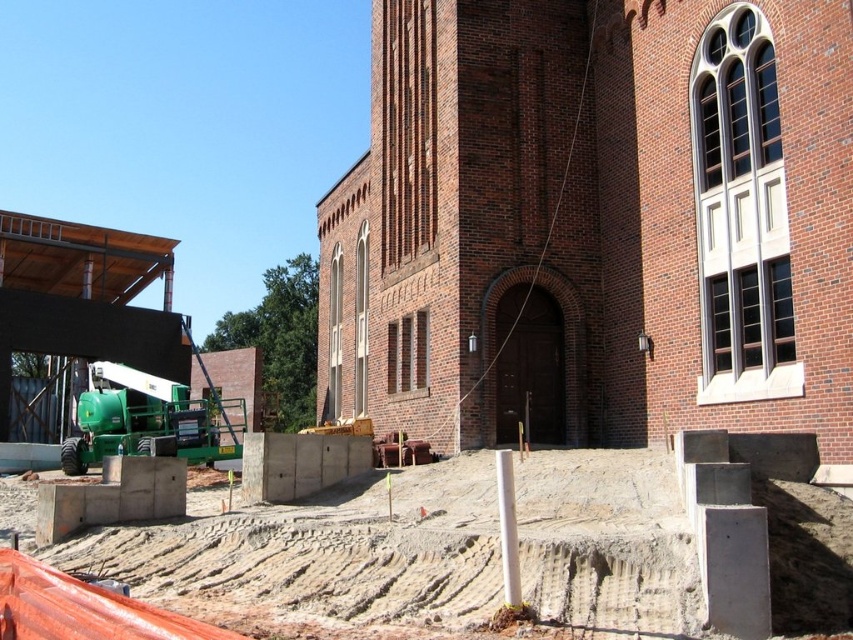
You are standing at the construction site and want to place a new concrete block exactly 20 meters away from your current position. Is the concrete at center already positioned at that distance?

The concrete at center is 19.58 meters away from the viewer, which is slightly less than 20 meters. Therefore, the concrete at center is not positioned at the desired distance of 20 meters.

You are a construction worker who needs to place a new pole that is 2 meters tall. You have two options for placement locations near the concrete at center and the green metallic crane at left. Based on their heights, which location would allow the pole to be visible without obstruction?

The green metallic crane at left is taller than the concrete at center. Since the pole is 2 meters tall, placing it near the shorter concrete at center would allow it to be visible without obstruction from the taller crane.

You are a construction worker needing to move a 3m wide equipment through the space between the concrete at center and the green metallic crane at left. Can the equipment pass through that space?

The concrete at center might be wider than green metallic crane at left, so the space between them may not be wide enough for the 3m wide equipment to pass through safely. Check the actual dimensions before proceeding.